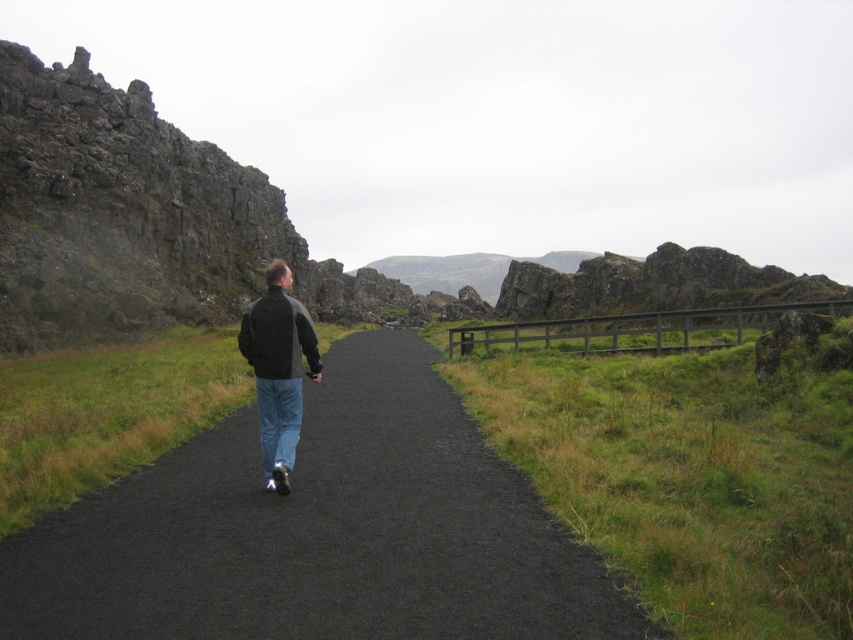
What do you see at coordinates (277, 369) in the screenshot?
I see `dark gray jacket at center` at bounding box center [277, 369].

Between dark gray jacket at center and blue denim jeans at center, which one is positioned lower?

Positioned lower is dark gray jacket at center.

Between point (289, 387) and point (289, 422), which one is positioned in front?

Point (289, 387) is more forward.

At what (x,y) coordinates should I click in order to perform the action: click on dark gray jacket at center. Please return your answer as a coordinate pair (x, y). The height and width of the screenshot is (640, 853). Looking at the image, I should click on (277, 369).

Who is more forward, (189, 202) or (283, 460)?

Point (283, 460)

Which of these two, rough stone cliff at upper left or blue denim jeans at center, stands shorter?

blue denim jeans at center is shorter.

Is point (15, 260) more distant than point (300, 378)?

Yes, it is.

I want to click on rough stone cliff at upper left, so pos(137,218).

Does rough stone cliff at upper left appear over dark gray jacket at center?

Yes.

Is rough stone cliff at upper left below dark gray jacket at center?

No.

Measure the distance between rough stone cliff at upper left and camera.

They are 25.76 meters apart.

Find the location of a particular element. This screenshot has height=640, width=853. rough stone cliff at upper left is located at coordinates (137, 218).